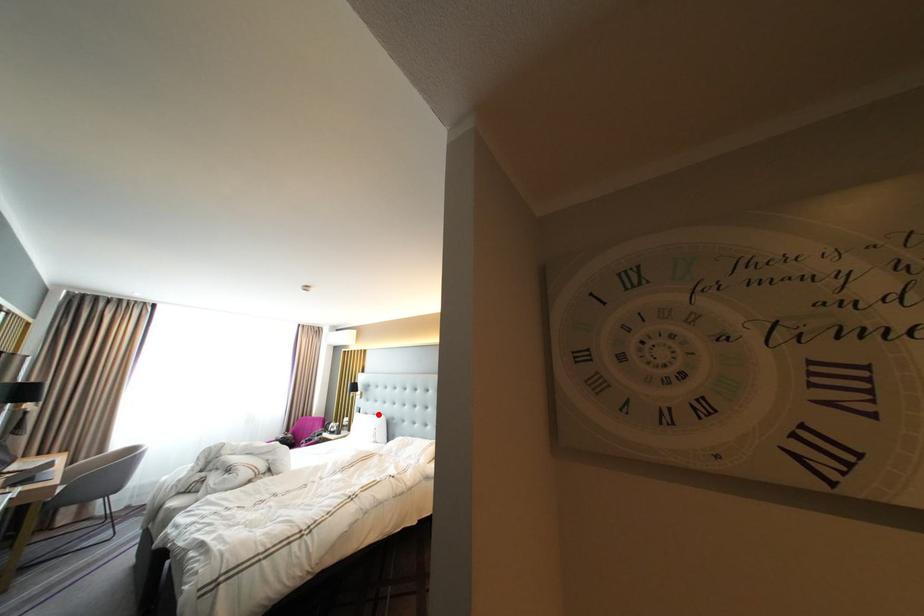
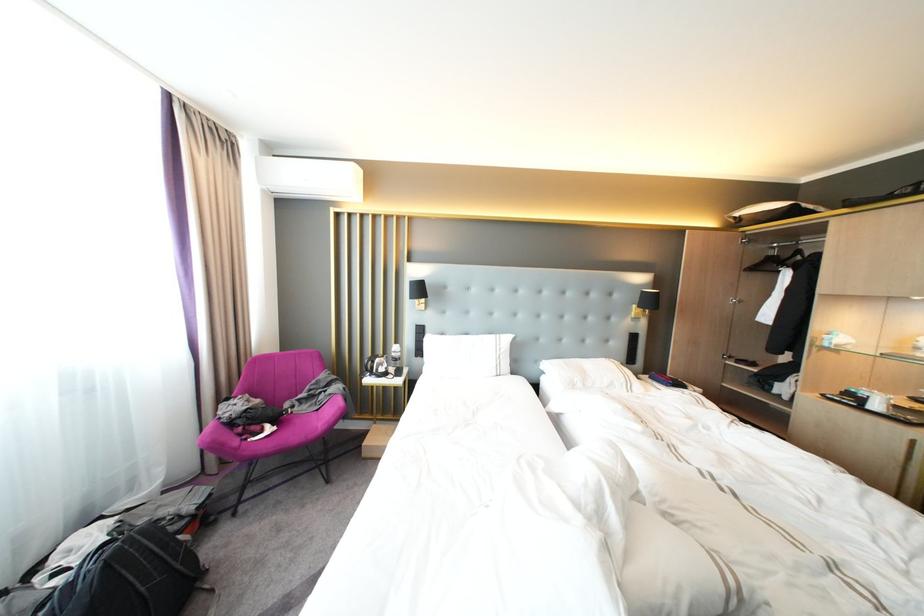
Where in the second image is the point corresponding to the highlighted location from the first image?

(455, 334)